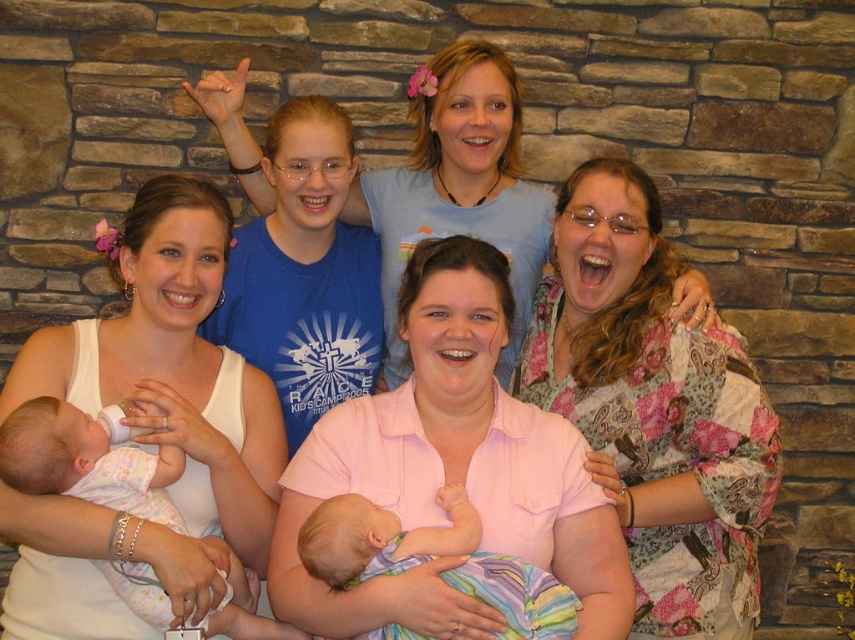
Looking at the image, there are two clothing items in focus. The pink cotton shirt at center and the white cotton onesie at lower left. Which of these two clothing items is wider?

The pink cotton shirt at center is wider than the white cotton onesie at lower left.